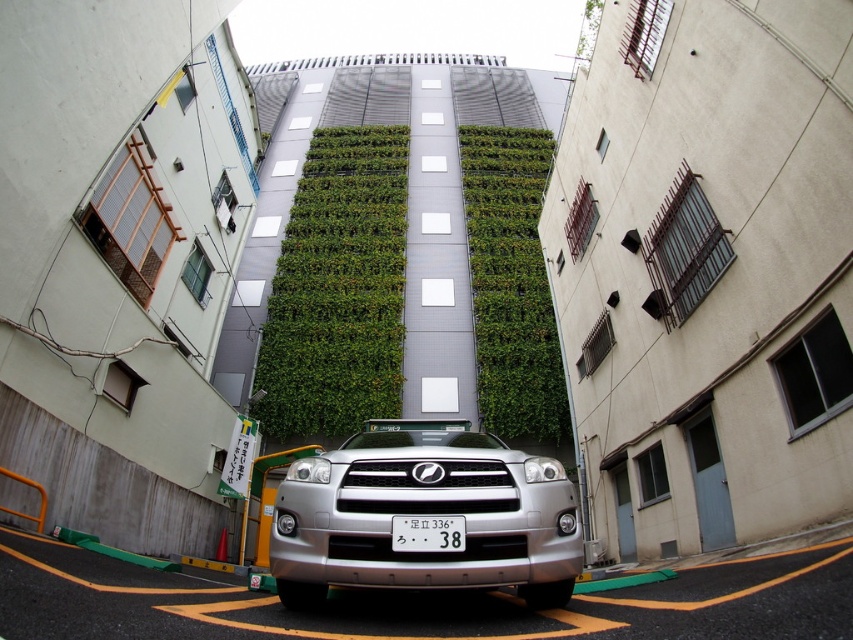
Does silver metallic suv at center appear under green leafy wall at center?

Correct, silver metallic suv at center is located below green leafy wall at center.

Does silver metallic suv at center come in front of green leafy wall at center?

Yes, silver metallic suv at center is closer to the viewer.

The width and height of the screenshot is (853, 640). Describe the element at coordinates (425, 515) in the screenshot. I see `silver metallic suv at center` at that location.

Where is `silver metallic suv at center`? The height and width of the screenshot is (640, 853). silver metallic suv at center is located at coordinates pos(425,515).

Does silver metallic car at center have a greater height compared to white plastic license plate at center?

In fact, silver metallic car at center may be shorter than white plastic license plate at center.

Which of these two, silver metallic car at center or white plastic license plate at center, stands shorter?

silver metallic car at center

The image size is (853, 640). I want to click on silver metallic car at center, so click(415, 604).

Looking at this image, is silver metallic suv at center taller than white plastic license plate at center?

Yes, silver metallic suv at center is taller than white plastic license plate at center.

Can you confirm if silver metallic suv at center is positioned to the right of white plastic license plate at center?

In fact, silver metallic suv at center is to the left of white plastic license plate at center.

Where is `silver metallic suv at center`? silver metallic suv at center is located at coordinates (425, 515).

Find the location of a particular element. silver metallic suv at center is located at coordinates (425, 515).